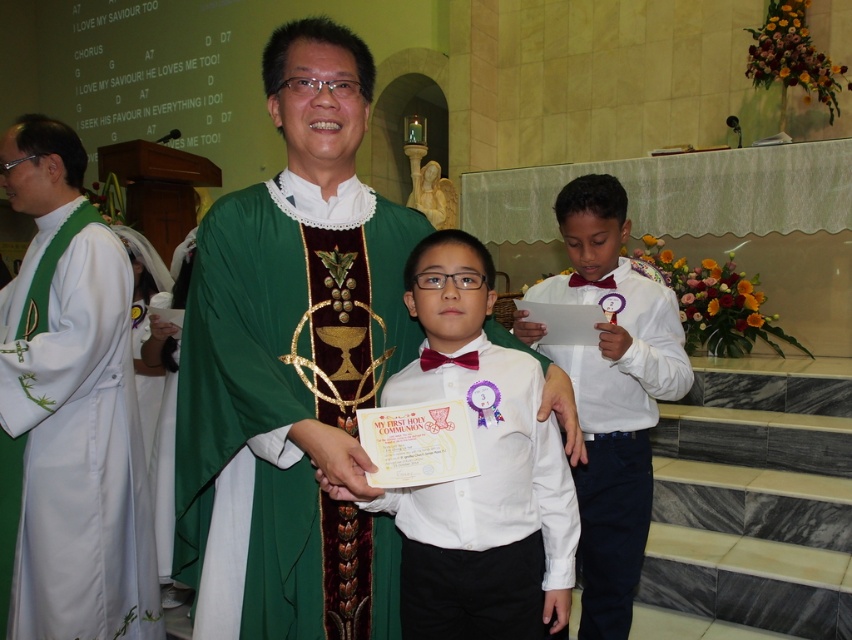
Between white glossy shirt at center and white satin robe at right, which one is positioned lower?

white satin robe at right is lower down.

In the scene shown: Is white glossy shirt at center shorter than white satin robe at right?

Indeed, white glossy shirt at center has a lesser height compared to white satin robe at right.

Does point (465, 292) come behind point (608, 564)?

No, it is in front of (608, 564).

The image size is (852, 640). What are the coordinates of `white glossy shirt at center` in the screenshot? It's located at (481, 468).

Is white silk robe at left bigger than white glossy shirt at center?

Correct, white silk robe at left is larger in size than white glossy shirt at center.

This screenshot has width=852, height=640. I want to click on white silk robe at left, so tap(76, 440).

Is point (81, 628) farther from camera compared to point (418, 321)?

That is True.

This screenshot has height=640, width=852. I want to click on white silk robe at left, so click(x=76, y=440).

Can you confirm if green satin robe at center is positioned to the right of white silk robe at left?

Indeed, green satin robe at center is positioned on the right side of white silk robe at left.

Is point (320, 516) positioned after point (67, 556)?

No, it is not.

Where is `green satin robe at center`? Image resolution: width=852 pixels, height=640 pixels. green satin robe at center is located at coordinates (292, 368).